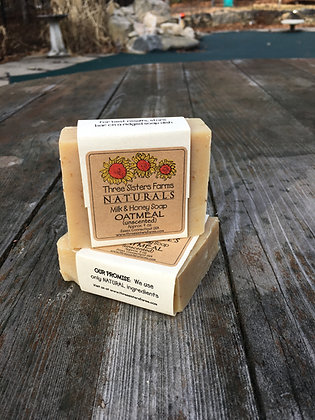
This screenshot has height=420, width=315. Identify the location of soap. (66, 175).